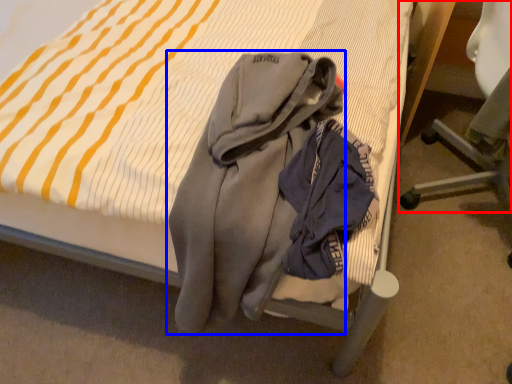
Question: Which object appears closest to the camera in this image, chair (highlighted by a red box) or garment (highlighted by a blue box)?

Choices:
 (A) chair
 (B) garment

Answer: (B)